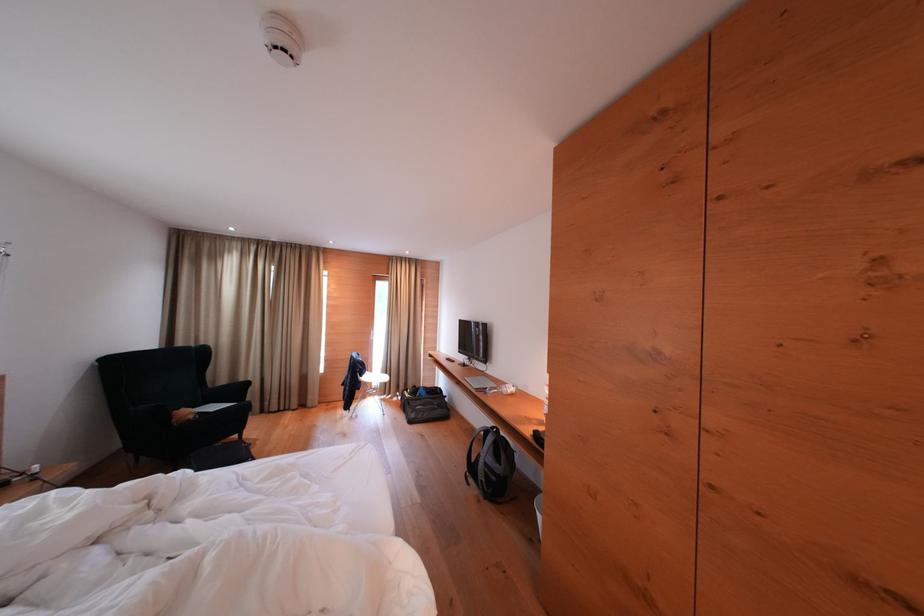
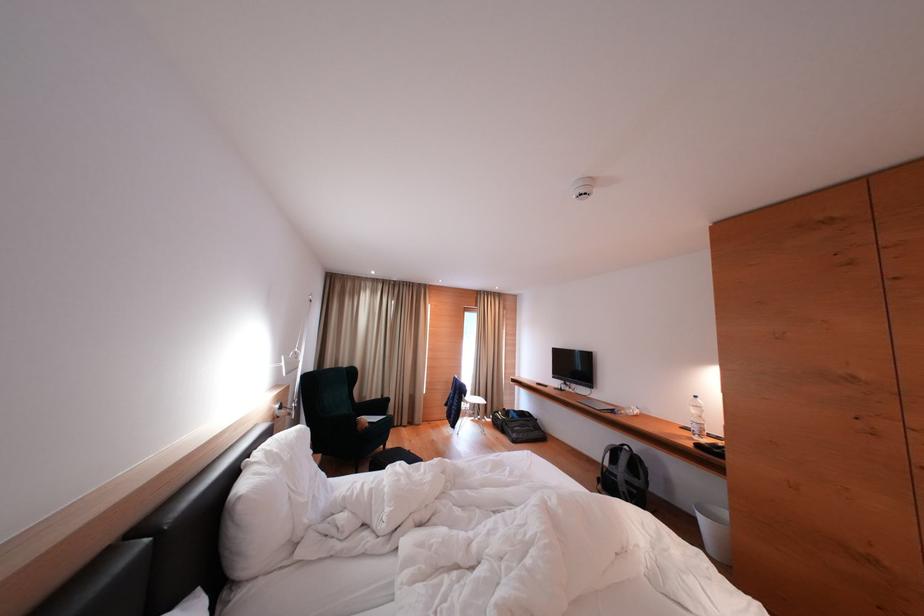
What movement of the cameraman would produce the second image?

The movement direction of the cameraman is left, backward.